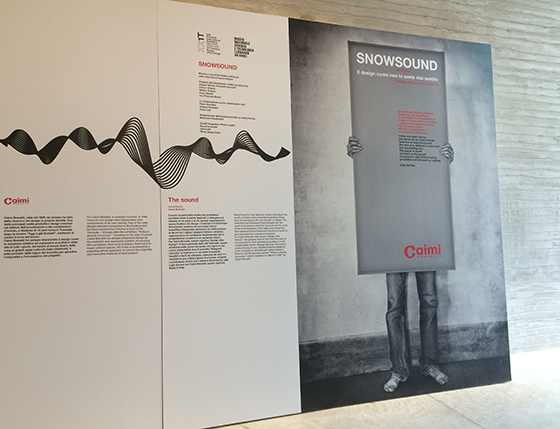
The height and width of the screenshot is (429, 560). Find the location of `wall`. wall is located at coordinates (520, 134).